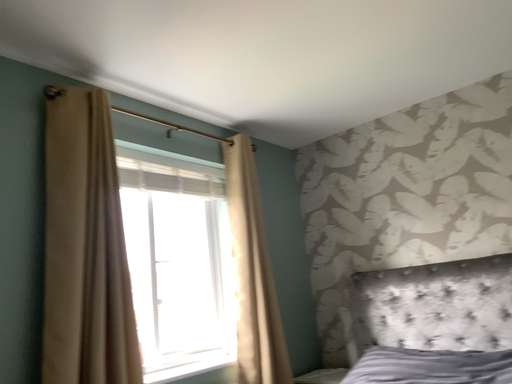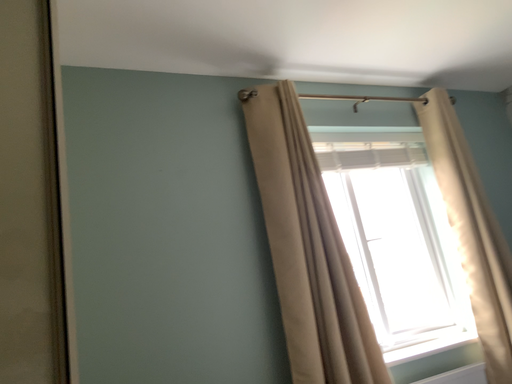
Question: How did the camera likely rotate when shooting the video?

Choices:
 (A) rotated right
 (B) rotated left

Answer: (B)